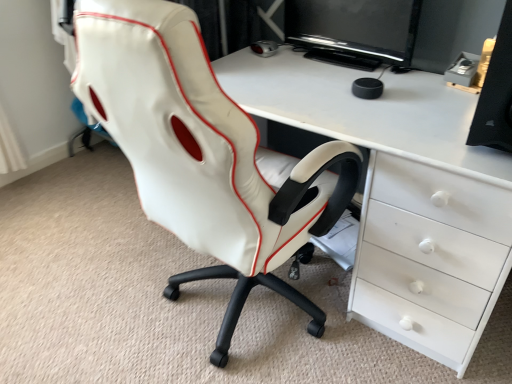
The height and width of the screenshot is (384, 512). Identify the location of free space to the left of black glossy monitor at upper center. (281, 69).